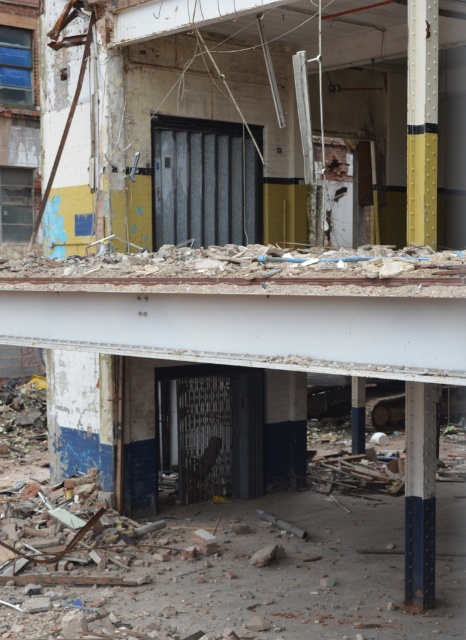
You are standing at the entrance of the building and want to locate both the yellow painted metal pole at upper right and the blue painted metal pole at lower right. According to the scene, which pole is positioned to the right side of the other?

The yellow painted metal pole at upper right is positioned to the right of the blue painted metal pole at lower right.

You are an inspector checking the structural integrity of the building. You notice the yellow painted metal pole at upper right and the blue painted metal pole at lower right. Which pole has a smaller width?

The yellow painted metal pole at upper right has a smaller width than the blue painted metal pole at lower right.